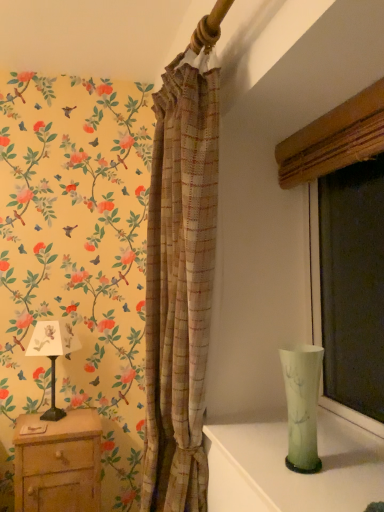
Question: Is the depth of matte wood window frame at right less than that of green translucent vase at right?

Choices:
 (A) no
 (B) yes

Answer: (B)

Question: Is matte wood window frame at right taller than green translucent vase at right?

Choices:
 (A) yes
 (B) no

Answer: (A)

Question: From a real-world perspective, is matte wood window frame at right on green translucent vase at right?

Choices:
 (A) yes
 (B) no

Answer: (A)

Question: From the image's perspective, does matte wood window frame at right appear lower than green translucent vase at right?

Choices:
 (A) no
 (B) yes

Answer: (A)

Question: Is matte wood window frame at right positioned with its back to green translucent vase at right?

Choices:
 (A) yes
 (B) no

Answer: (B)

Question: In terms of width, does wooden nightstand at lower left look wider or thinner when compared to white paper lampshade at left?

Choices:
 (A) thin
 (B) wide

Answer: (B)

Question: Looking at the image, does wooden nightstand at lower left seem bigger or smaller compared to white paper lampshade at left?

Choices:
 (A) small
 (B) big

Answer: (B)

Question: Do you think wooden nightstand at lower left is within white paper lampshade at left, or outside of it?

Choices:
 (A) inside
 (B) outside

Answer: (B)

Question: Relative to white paper lampshade at left, is wooden nightstand at lower left in front or behind?

Choices:
 (A) behind
 (B) front

Answer: (B)

Question: Considering the positions of point (332, 162) and point (56, 343), is point (332, 162) closer or farther from the camera than point (56, 343)?

Choices:
 (A) farther
 (B) closer

Answer: (B)

Question: Is matte wood window frame at right wider or thinner than white paper lampshade at left?

Choices:
 (A) thin
 (B) wide

Answer: (A)

Question: Is matte wood window frame at right taller or shorter than white paper lampshade at left?

Choices:
 (A) tall
 (B) short

Answer: (A)

Question: Is matte wood window frame at right inside the boundaries of white paper lampshade at left, or outside?

Choices:
 (A) inside
 (B) outside

Answer: (B)

Question: Is point (288, 406) positioned closer to the camera than point (326, 147)?

Choices:
 (A) closer
 (B) farther

Answer: (A)

Question: Is green translucent vase at right taller or shorter than matte wood window frame at right?

Choices:
 (A) short
 (B) tall

Answer: (A)